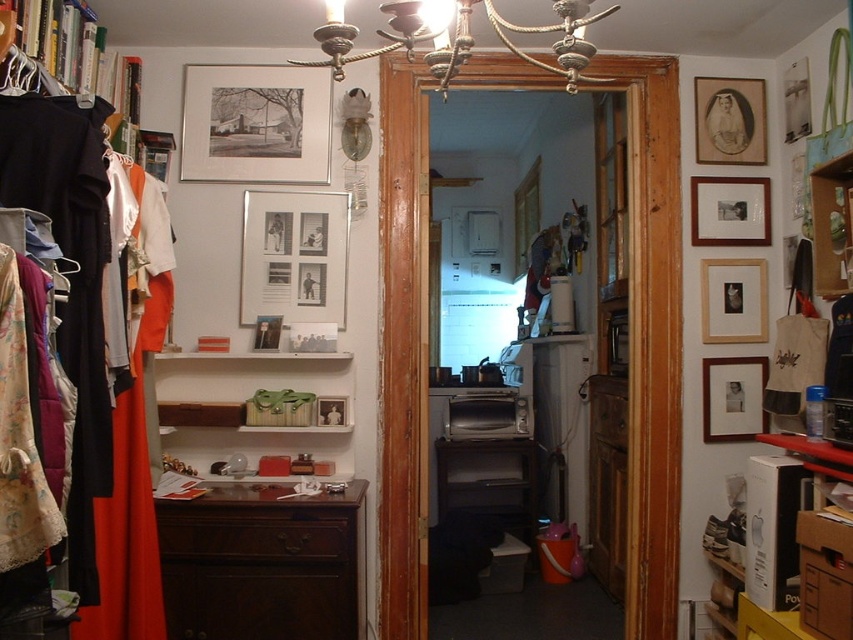
Is point (0, 163) closer to camera compared to point (758, 420)?

Yes, point (0, 163) is closer to viewer.

Can you confirm if matte black clothes at left is shorter than wooden photo frame at right?

Incorrect, matte black clothes at left's height does not fall short of wooden photo frame at right's.

Between point (68, 531) and point (705, 403), which one is positioned behind?

The point (705, 403) is more distant.

Find the location of a particular element. This screenshot has height=640, width=853. matte black clothes at left is located at coordinates (93, 364).

Is point (268, 545) closer to camera compared to point (596, 394)?

Yes, it is.

You are a GUI agent. You are given a task and a screenshot of the screen. Output one action in this format:
    pyautogui.click(x=<x>, y=<y>)
    Task: Click on the brown wood drawer at lower center
    The image size is (853, 640).
    Given the screenshot: What is the action you would take?
    pyautogui.click(x=253, y=538)

Which is below, matte black portrait at upper right or wooden picture frame at upper right?

wooden picture frame at upper right is below.

Is point (711, 145) closer to camera compared to point (750, 188)?

Yes, it is in front of point (750, 188).

Identify the location of matte black portrait at upper right. This screenshot has height=640, width=853. click(x=729, y=120).